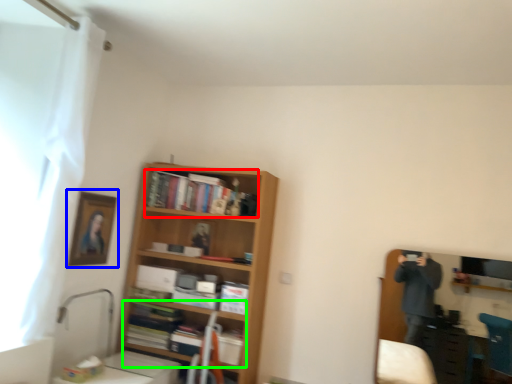
Question: Based on their relative distances, which object is nearer to book (highlighted by a red box)? Choose from picture frame (highlighted by a blue box) and book (highlighted by a green box).

Choices:
 (A) picture frame
 (B) book

Answer: (A)